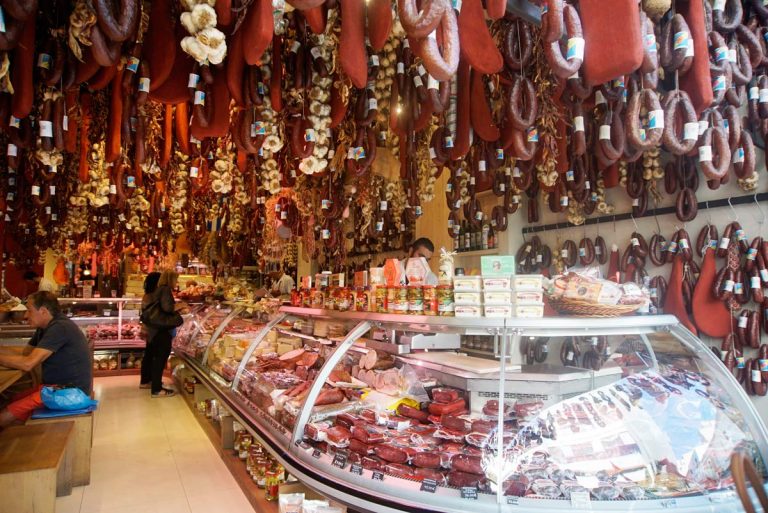
Locate an element on the screen. This screenshot has width=768, height=513. elbow on table is located at coordinates (27, 367).